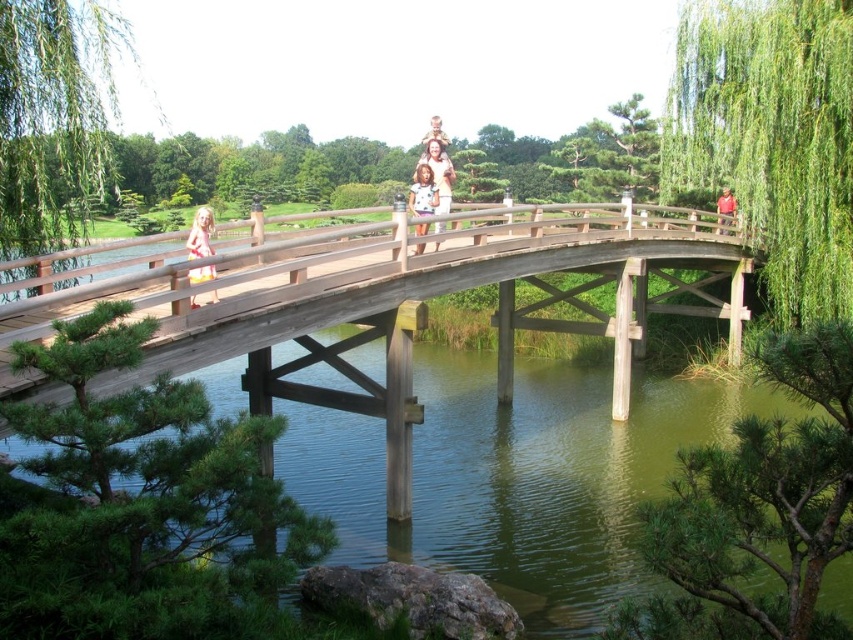
Between point (424, 266) and point (451, 172), which one is positioned behind?

The point (451, 172) is more distant.

At what (x,y) coordinates should I click in order to perform the action: click on wooden bridge at center. Please return your answer as a coordinate pair (x, y). This screenshot has height=640, width=853. Looking at the image, I should click on (440, 294).

Image resolution: width=853 pixels, height=640 pixels. I want to click on wooden bridge at center, so click(440, 294).

Does matte pink dress at left appear over light brown wooden bridge at center?

No.

Between point (207, 269) and point (438, 205), which one is positioned behind?

Point (438, 205)

Is point (202, 209) less distant than point (447, 189)?

Yes, it is.

Identify the location of matte pink dress at left. (200, 234).

Can you confirm if green liquid water at bridge center is smaller than red cotton shirt at upper center?

Incorrect, green liquid water at bridge center is not smaller in size than red cotton shirt at upper center.

Is point (660, 461) closer to camera compared to point (728, 220)?

Yes.

This screenshot has width=853, height=640. In order to click on green liquid water at bridge center in this screenshot , I will do `click(515, 476)`.